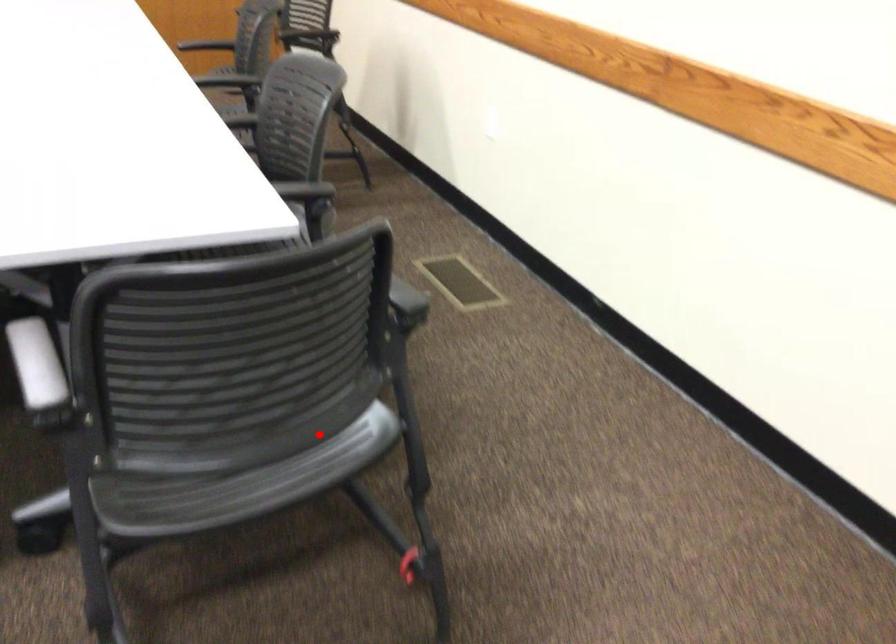
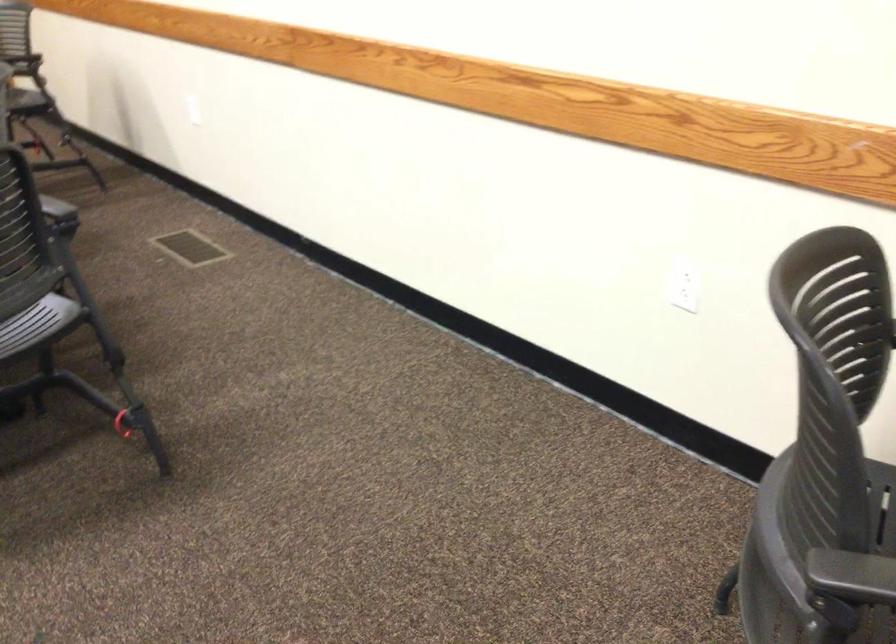
Question: I am providing you with two images of the same scene from different viewpoints. Given a red point in image1, look at the same physical point in image2. Is it:

Choices:
 (A) Closer to the viewpoint
 (B) Farther from the viewpoint

Answer: (B)